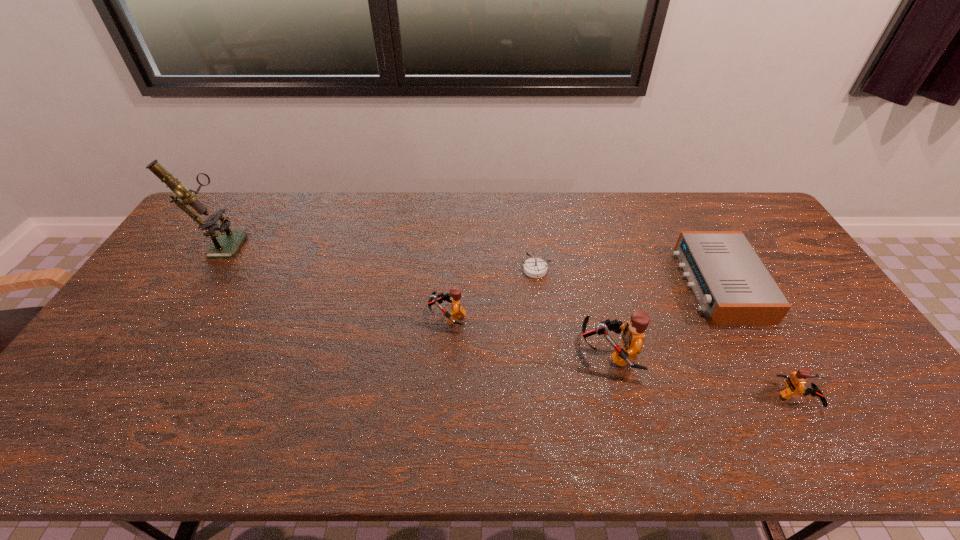
Find the location of a particular element. the third object from left to right is located at coordinates (534, 267).

Locate an element on the screen. This screenshot has height=540, width=960. free space located holding a crossbow in the hands of the fourth shortest object is located at coordinates [x=358, y=316].

Where is `blank space located 0.120m holding a crossbow in the hands of the fourth shortest object`? The image size is (960, 540). blank space located 0.120m holding a crossbow in the hands of the fourth shortest object is located at coordinates (386, 316).

Find the location of `free location located holding a crossbow in the hands of the fourth shortest object`. free location located holding a crossbow in the hands of the fourth shortest object is located at coordinates (394, 316).

At what (x,y) coordinates should I click in order to perform the action: click on vacant space located holding a crossbow in the hands of the third object from right to left. Please return your answer as a coordinate pair (x, y). This screenshot has height=540, width=960. Looking at the image, I should click on (437, 354).

Locate an element on the screen. The image size is (960, 540). vacant space located 0.100m holding a crossbow in the hands of the third object from right to left is located at coordinates (542, 354).

Locate an element on the screen. This screenshot has width=960, height=540. vacant space situated 0.200m holding a crossbow in the hands of the third object from right to left is located at coordinates (505, 354).

At what (x,y) coordinates should I click in order to perform the action: click on vacant area situated holding a crossbow in the hands of the shortest Lego. Please return your answer as a coordinate pair (x, y). Looking at the image, I should click on (892, 397).

At what (x,y) coordinates should I click in order to perform the action: click on vacant region located 0.180m at the eyepiece of the tallest object. Please return your answer as a coordinate pair (x, y). Looking at the image, I should click on (298, 244).

The width and height of the screenshot is (960, 540). I want to click on blank space located on the control panel of the second shortest object, so click(x=603, y=285).